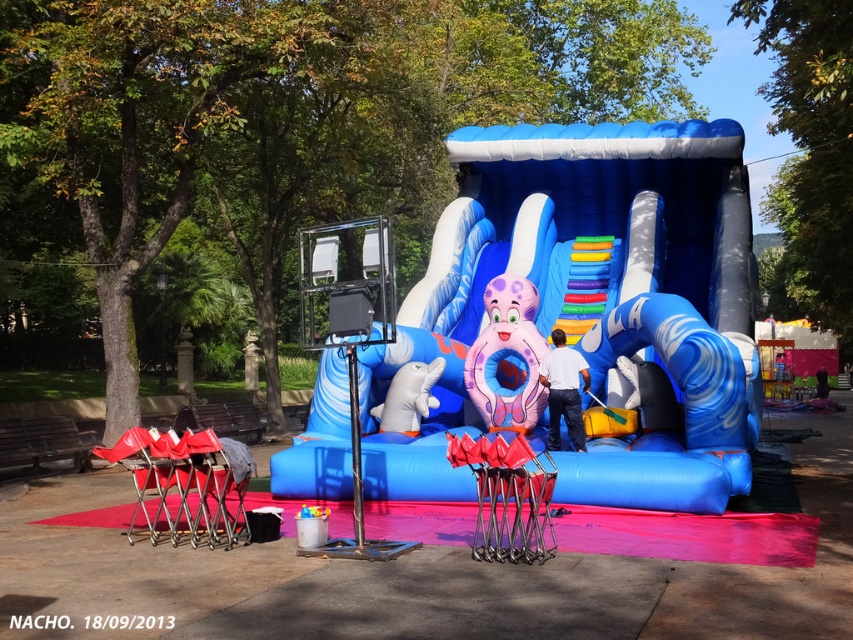
Question: Does blue inflatable slide at center appear under metallic silver folding chair at lower left?

Choices:
 (A) no
 (B) yes

Answer: (A)

Question: Which of the following is the closest to the observer?

Choices:
 (A) pink rubber octopus at center
 (B) metallic silver folding chair at lower left

Answer: (B)

Question: Can you confirm if pink rubber octopus at center is wider than white rubber dolphin at lower left?

Choices:
 (A) no
 (B) yes

Answer: (B)

Question: Which point is farther from the camera taking this photo?

Choices:
 (A) (224, 515)
 (B) (166, 492)
 (C) (494, 372)
 (D) (408, 385)

Answer: (D)

Question: Can you confirm if pink rubber octopus at center is positioned above white rubber dolphin at lower left?

Choices:
 (A) no
 (B) yes

Answer: (B)

Question: Estimate the real-world distances between objects in this image. Which object is farther from the metallic silver folding chair at lower left?

Choices:
 (A) pink rubber octopus at center
 (B) metallic red chair at lower left
 (C) blue inflatable slide at center

Answer: (C)